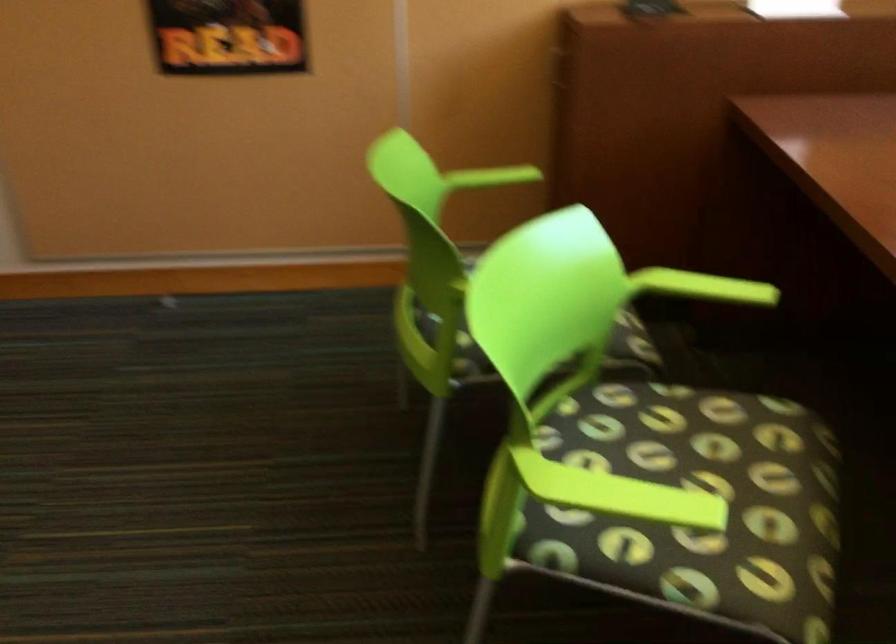
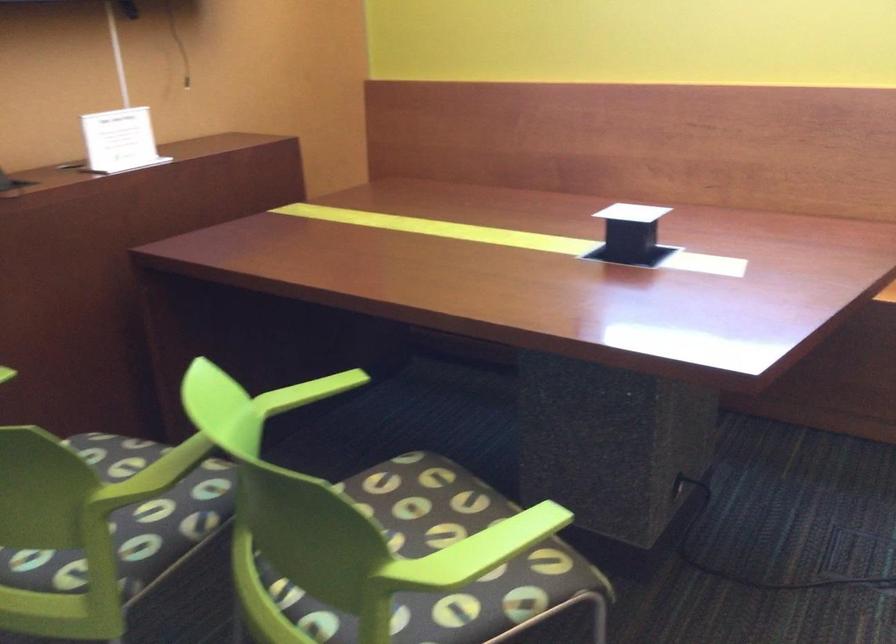
Find the pixel in the second image that matches the point at 702,288 in the first image.

(307, 392)